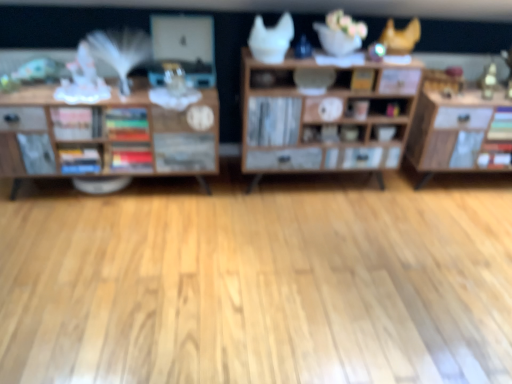
Question: From a real-world perspective, is wooden cabinet at center, the second shelf when ordered from left to right, positioned under multicolored hardcover books at center, the second book from the right, based on gravity?

Choices:
 (A) yes
 (B) no

Answer: (A)

Question: From a real-world perspective, does wooden cabinet at center, the second shelf when ordered from left to right, stand above multicolored hardcover books at center, the second book from the right?

Choices:
 (A) yes
 (B) no

Answer: (B)

Question: Is wooden cabinet at center, the first shelf positioned from the right, behind multicolored hardcover books at center, which appears as the third book when viewed from the left?

Choices:
 (A) yes
 (B) no

Answer: (B)

Question: From the image's perspective, does wooden cabinet at center, the second shelf when ordered from left to right, appear higher than multicolored hardcover books at center, which appears as the third book when viewed from the left?

Choices:
 (A) no
 (B) yes

Answer: (B)

Question: Considering the relative sizes of wooden cabinet at center, the second shelf when ordered from left to right, and multicolored hardcover books at center, the second book from the right, in the image provided, is wooden cabinet at center, the second shelf when ordered from left to right, bigger than multicolored hardcover books at center, the second book from the right,?

Choices:
 (A) no
 (B) yes

Answer: (B)

Question: Based on their positions, is matte white bowl at center located to the left or right of yellow matte book at center, the 4th book when ordered from left to right?

Choices:
 (A) left
 (B) right

Answer: (B)

Question: Is matte white bowl at center bigger or smaller than yellow matte book at center, acting as the first book starting from the right?

Choices:
 (A) small
 (B) big

Answer: (B)

Question: Is point (382, 140) closer or farther from the camera than point (353, 77)?

Choices:
 (A) closer
 (B) farther

Answer: (B)

Question: Is matte white bowl at center inside the boundaries of yellow matte book at center, the 4th book when ordered from left to right, or outside?

Choices:
 (A) outside
 (B) inside

Answer: (A)

Question: In terms of width, does wooden bookshelf at left, the 1th shelf positioned from the left, look wider or thinner when compared to multicolored hardcover books at center, the second book from the right?

Choices:
 (A) thin
 (B) wide

Answer: (B)

Question: From a real-world perspective, is wooden bookshelf at left, the 1th shelf positioned from the left, positioned above or below multicolored hardcover books at center, which appears as the third book when viewed from the left?

Choices:
 (A) below
 (B) above

Answer: (A)

Question: Would you say wooden bookshelf at left, marked as the second shelf in a right-to-left arrangement, is to the left or to the right of multicolored hardcover books at center, the second book from the right, in the picture?

Choices:
 (A) right
 (B) left

Answer: (B)

Question: From the image's perspective, is wooden bookshelf at left, the 1th shelf positioned from the left, positioned above or below multicolored hardcover books at center, the second book from the right?

Choices:
 (A) above
 (B) below

Answer: (B)

Question: Does point pos(120,114) appear closer or farther from the camera than point pos(288,57)?

Choices:
 (A) farther
 (B) closer

Answer: (B)

Question: In terms of width, does multicolored hardcover books at center, which appears as the third book when viewed from the left, look wider or thinner when compared to wooden cabinet at center, the first shelf positioned from the right?

Choices:
 (A) wide
 (B) thin

Answer: (B)